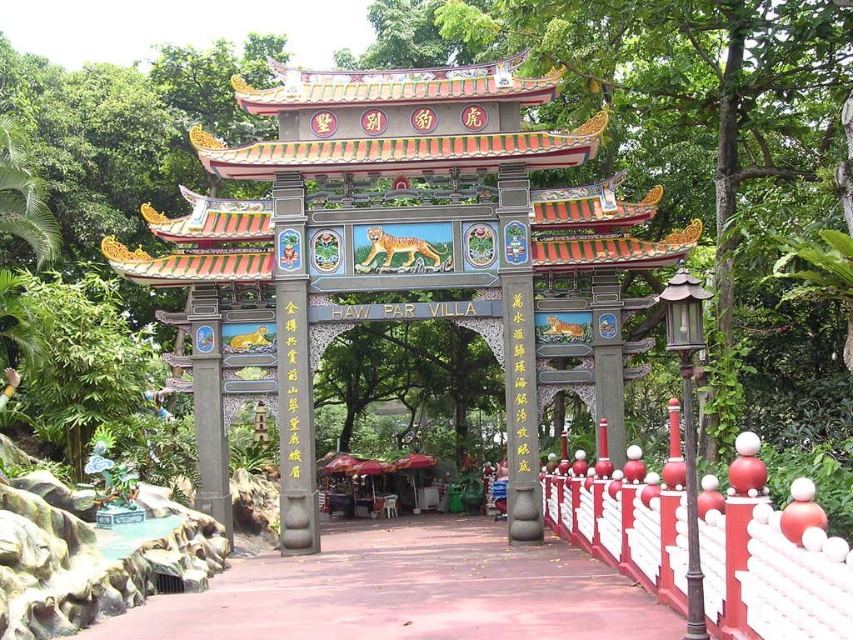
Question: Does red concrete path at lower left have a larger size compared to white painted wood fence at lower right?

Choices:
 (A) yes
 (B) no

Answer: (A)

Question: Which point is closer to the camera?

Choices:
 (A) (781, 628)
 (B) (572, 554)

Answer: (A)

Question: Can you confirm if red concrete path at lower left is positioned above white painted wood fence at lower right?

Choices:
 (A) no
 (B) yes

Answer: (A)

Question: Which of the following is the closest to the observer?

Choices:
 (A) (556, 538)
 (B) (828, 634)

Answer: (B)

Question: Which point is farther to the camera?

Choices:
 (A) white painted wood fence at lower right
 (B) red concrete path at lower left

Answer: (B)

Question: Can you confirm if red concrete path at lower left is smaller than white painted wood fence at lower right?

Choices:
 (A) no
 (B) yes

Answer: (A)